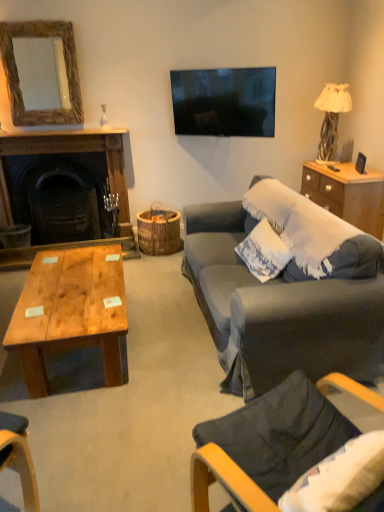
Where is `vacant point to the right of wooden coffee table at center`? vacant point to the right of wooden coffee table at center is located at coordinates (169, 350).